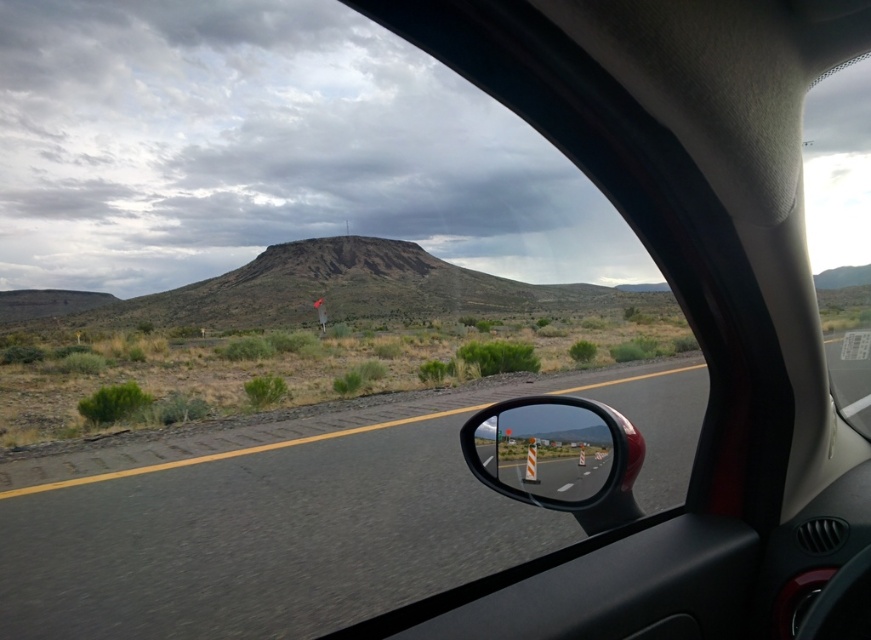
Question: Which object appears closest to the camera in this image?

Choices:
 (A) shiny chrome mirror at right
 (B) transparent glass car window at upper right

Answer: (A)

Question: Based on their relative distances, which object is farther from the asphalt road at center?

Choices:
 (A) shiny chrome mirror at right
 (B) transparent glass car window at upper right

Answer: (B)

Question: Among these objects, which one is nearest to the camera?

Choices:
 (A) shiny chrome mirror at right
 (B) transparent glass car window at upper right

Answer: (A)

Question: From the image, what is the correct spatial relationship of shiny chrome mirror at right in relation to transparent glass car window at upper right?

Choices:
 (A) above
 (B) below

Answer: (B)

Question: Does asphalt road at center have a larger size compared to transparent glass car window at upper right?

Choices:
 (A) yes
 (B) no

Answer: (B)

Question: Is asphalt road at center wider than shiny chrome mirror at right?

Choices:
 (A) yes
 (B) no

Answer: (A)